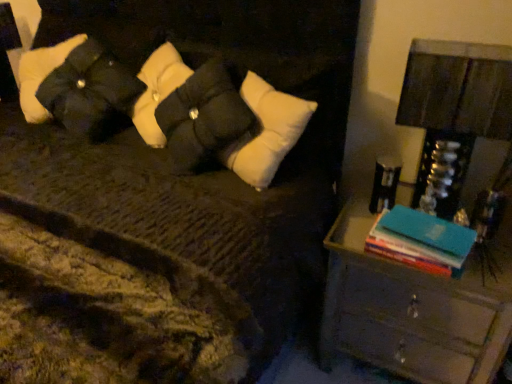
Question: From their relative heights in the image, would you say wooden nightstand at right is taller or shorter than blue hardcover book at right?

Choices:
 (A) short
 (B) tall

Answer: (B)

Question: Is wooden nightstand at right spatially inside blue hardcover book at right, or outside of it?

Choices:
 (A) inside
 (B) outside

Answer: (B)

Question: Which object is the farthest from the wooden nightstand at right?

Choices:
 (A) blue hardcover book at right
 (B) black quilted pillow at upper left
 (C) metallic silver lampshade at right

Answer: (B)

Question: Which object is positioned farthest from the wooden nightstand at right?

Choices:
 (A) metallic silver lampshade at right
 (B) black quilted pillow at upper left
 (C) blue hardcover book at right

Answer: (B)